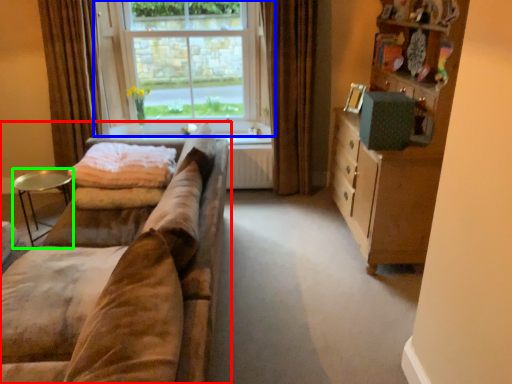
Question: Based on their relative distances, which object is farther from studio couch (highlighted by a red box)? Choose from window (highlighted by a blue box) and table (highlighted by a green box).

Choices:
 (A) window
 (B) table

Answer: (A)